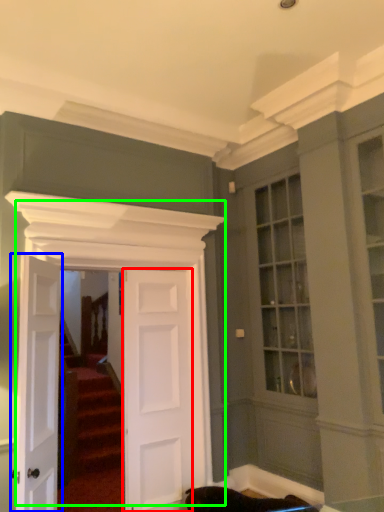
Question: Which is farther away from door (highlighted by a red box)? door (highlighted by a blue box) or door (highlighted by a green box)?

Choices:
 (A) door
 (B) door

Answer: (A)